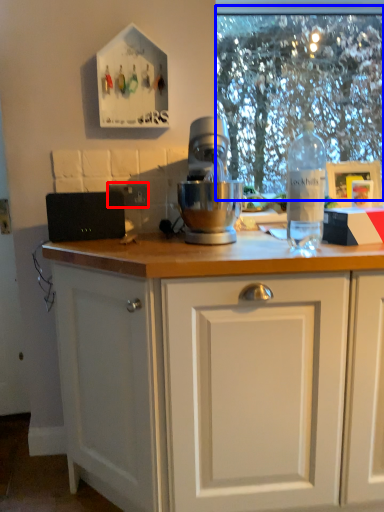
Question: Which object is closer to the camera taking this photo, electric outlet (highlighted by a red box) or clear (highlighted by a blue box)?

Choices:
 (A) electric outlet
 (B) clear

Answer: (A)